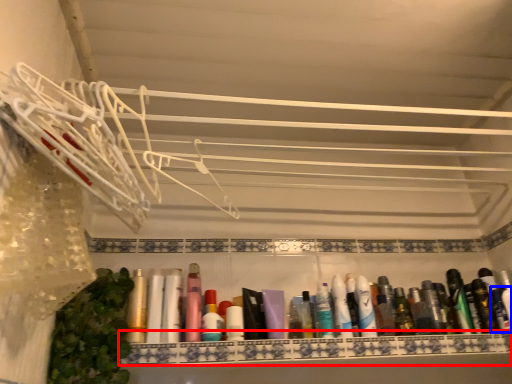
Question: Which object is further to the camera taking this photo, cabinet (highlighted by a red box) or toiletry (highlighted by a blue box)?

Choices:
 (A) cabinet
 (B) toiletry

Answer: (B)